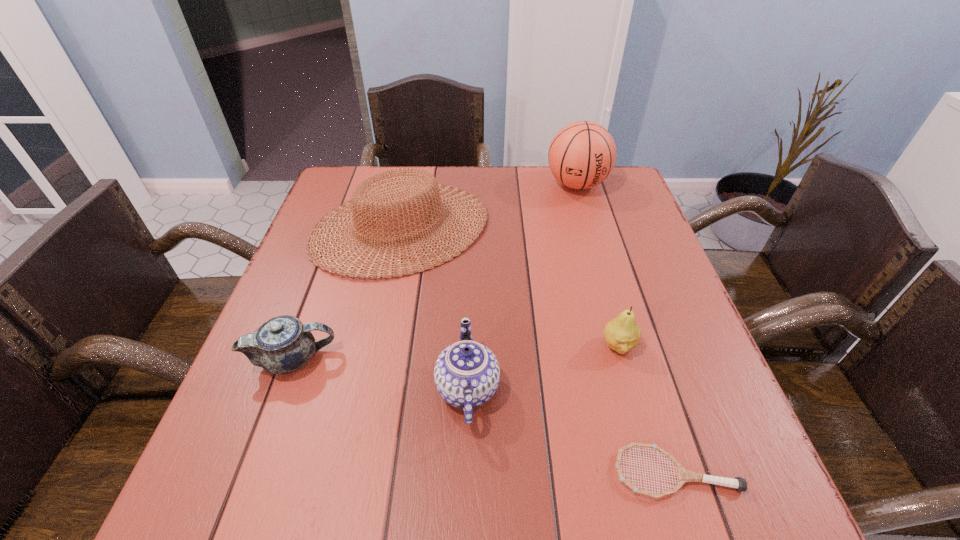
You are a GUI agent. You are given a task and a screenshot of the screen. Output one action in this format:
    pyautogui.click(x=<x>, y=<y>)
    Task: Click on the vacant region between the basketball and the sunhat
    The image size is (960, 540).
    Given the screenshot: What is the action you would take?
    coord(489,206)

Identify the location of vacant space that's between the nearest object and the pear. This screenshot has height=540, width=960. tap(647, 409).

At what (x,y) coordinates should I click in order to perform the action: click on free space between the left chinaware and the tennis racket. Please return your answer as a coordinate pair (x, y). The width and height of the screenshot is (960, 540). Looking at the image, I should click on (485, 416).

The height and width of the screenshot is (540, 960). Find the location of `unoccupied area between the right chinaware and the tennis racket`. unoccupied area between the right chinaware and the tennis racket is located at coordinates (571, 430).

Identify the location of empty space between the right chinaware and the basketball. (522, 286).

Identify the location of free space between the sunhat and the right chinaware. (434, 308).

Locate an element on the screen. free space between the tallest object and the right chinaware is located at coordinates (522, 286).

Where is `vacant region between the sunhat and the tennis racket`? This screenshot has width=960, height=540. vacant region between the sunhat and the tennis racket is located at coordinates (539, 349).

This screenshot has height=540, width=960. I want to click on vacant space in between the pear and the shortest object, so click(647, 409).

Choose which object is the fifth nearest neighbor to the shortest object. Please provide its 2D coordinates. Your answer should be formatted as a tuple, i.e. [(x, y)], where the tuple contains the x and y coordinates of a point satisfying the conditions above.

[(582, 154)]